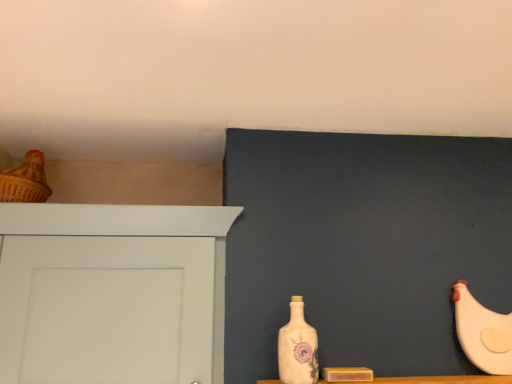
Question: From a real-world perspective, is porcelain floral bottle at center under white matte chicken at right, arranged as the first chicken when ordered from the bottom?

Choices:
 (A) yes
 (B) no

Answer: (A)

Question: Does porcelain floral bottle at center have a lesser width compared to white matte chicken at right, marked as the second chicken in a left-to-right arrangement?

Choices:
 (A) no
 (B) yes

Answer: (A)

Question: Considering the relative positions of porcelain floral bottle at center and white matte chicken at right, the 2th chicken in the top-to-bottom sequence, in the image provided, is porcelain floral bottle at center to the left of white matte chicken at right, the 2th chicken in the top-to-bottom sequence, from the viewer's perspective?

Choices:
 (A) yes
 (B) no

Answer: (A)

Question: Considering the relative positions of porcelain floral bottle at center and white matte chicken at right, arranged as the first chicken when ordered from the bottom, in the image provided, is porcelain floral bottle at center to the right of white matte chicken at right, arranged as the first chicken when ordered from the bottom, from the viewer's perspective?

Choices:
 (A) yes
 (B) no

Answer: (B)

Question: Considering the relative sizes of porcelain floral bottle at center and white matte chicken at right, arranged as the first chicken when ordered from the bottom, in the image provided, is porcelain floral bottle at center shorter than white matte chicken at right, arranged as the first chicken when ordered from the bottom,?

Choices:
 (A) yes
 (B) no

Answer: (A)

Question: Which is correct: matte brown chicken at upper left, which ranks as the 1th chicken in left-to-right order, is inside porcelain floral bottle at center, or outside of it?

Choices:
 (A) inside
 (B) outside

Answer: (B)

Question: Visually, is matte brown chicken at upper left, acting as the 2th chicken starting from the bottom, positioned to the left or to the right of porcelain floral bottle at center?

Choices:
 (A) right
 (B) left

Answer: (B)

Question: Does point (38, 198) appear closer or farther from the camera than point (290, 352)?

Choices:
 (A) closer
 (B) farther

Answer: (B)

Question: Looking at their shapes, would you say matte brown chicken at upper left, which ranks as the 1th chicken in left-to-right order, is wider or thinner than porcelain floral bottle at center?

Choices:
 (A) wide
 (B) thin

Answer: (A)

Question: Is white matte chicken at right, arranged as the first chicken when ordered from the bottom, bigger or smaller than white painted wood door at left?

Choices:
 (A) small
 (B) big

Answer: (A)

Question: In the image, is white matte chicken at right, which is the 1th chicken in right-to-left order, positioned in front of or behind white painted wood door at left?

Choices:
 (A) front
 (B) behind

Answer: (B)

Question: Is point [454, 286] positioned closer to the camera than point [152, 259]?

Choices:
 (A) farther
 (B) closer

Answer: (A)

Question: From the image's perspective, relative to white painted wood door at left, is white matte chicken at right, which is the 1th chicken in right-to-left order, above or below?

Choices:
 (A) above
 (B) below

Answer: (B)

Question: From the image's perspective, relative to white painted wood door at left, is porcelain floral bottle at center above or below?

Choices:
 (A) above
 (B) below

Answer: (B)

Question: In terms of size, does porcelain floral bottle at center appear bigger or smaller than white painted wood door at left?

Choices:
 (A) big
 (B) small

Answer: (B)